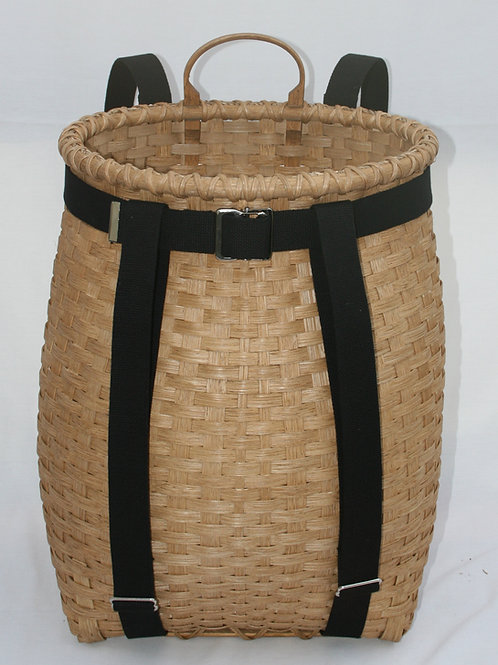
Where is `bottom corner of basket`? bottom corner of basket is located at coordinates (399, 636), (79, 636).